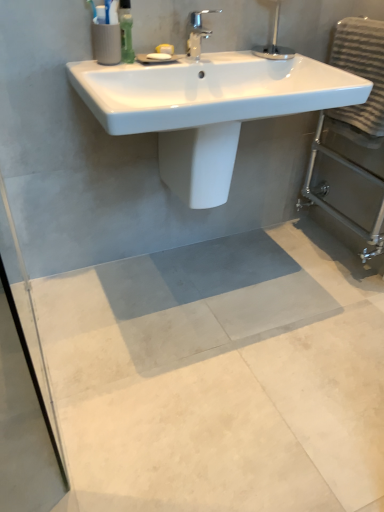
Question: Can you confirm if gray concrete mat at center is shorter than white glossy sink at upper center?

Choices:
 (A) yes
 (B) no

Answer: (A)

Question: Can you confirm if gray concrete mat at center is taller than white glossy sink at upper center?

Choices:
 (A) no
 (B) yes

Answer: (A)

Question: Considering the relative positions of gray concrete mat at center and white glossy sink at upper center in the image provided, is gray concrete mat at center behind white glossy sink at upper center?

Choices:
 (A) yes
 (B) no

Answer: (B)

Question: From a real-world perspective, is gray concrete mat at center positioned over white glossy sink at upper center based on gravity?

Choices:
 (A) no
 (B) yes

Answer: (A)

Question: Is gray concrete mat at center oriented away from white glossy sink at upper center?

Choices:
 (A) yes
 (B) no

Answer: (B)

Question: Looking at their shapes, would you say white glossy sink at upper center is wider or thinner than gray textured towel at right?

Choices:
 (A) thin
 (B) wide

Answer: (B)

Question: Looking at the image, does white glossy sink at upper center seem bigger or smaller compared to gray textured towel at right?

Choices:
 (A) big
 (B) small

Answer: (A)

Question: Which is correct: white glossy sink at upper center is inside gray textured towel at right, or outside of it?

Choices:
 (A) inside
 (B) outside

Answer: (B)

Question: Does point (104, 115) appear closer or farther from the camera than point (360, 44)?

Choices:
 (A) closer
 (B) farther

Answer: (A)

Question: From a real-world perspective, is chrome metallic faucet at upper center above or below gray textured towel at right?

Choices:
 (A) above
 (B) below

Answer: (A)

Question: Is chrome metallic faucet at upper center in front of or behind gray textured towel at right in the image?

Choices:
 (A) behind
 (B) front

Answer: (A)

Question: In terms of size, does chrome metallic faucet at upper center appear bigger or smaller than gray textured towel at right?

Choices:
 (A) small
 (B) big

Answer: (A)

Question: Is chrome metallic faucet at upper center inside the boundaries of gray textured towel at right, or outside?

Choices:
 (A) inside
 (B) outside

Answer: (B)

Question: From the image's perspective, relative to gray textured towel at right, is gray concrete mat at center above or below?

Choices:
 (A) below
 (B) above

Answer: (A)

Question: In terms of width, does gray concrete mat at center look wider or thinner when compared to gray textured towel at right?

Choices:
 (A) wide
 (B) thin

Answer: (A)